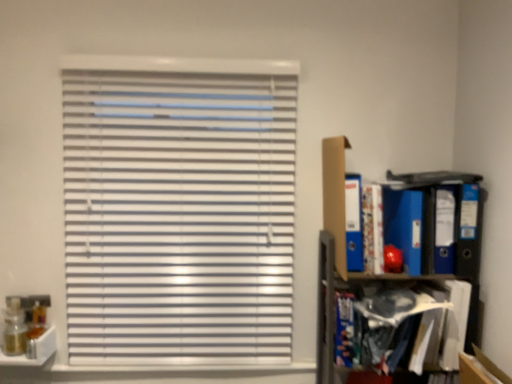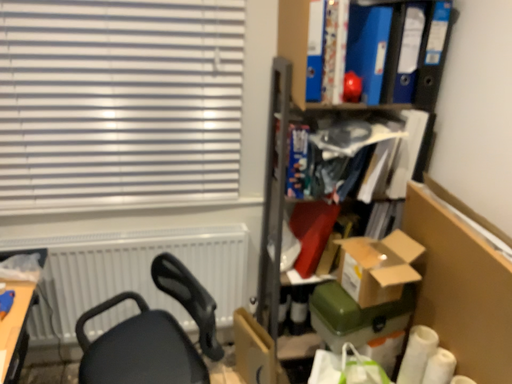
Question: How did the camera likely rotate when shooting the video?

Choices:
 (A) rotated upward
 (B) rotated downward

Answer: (B)